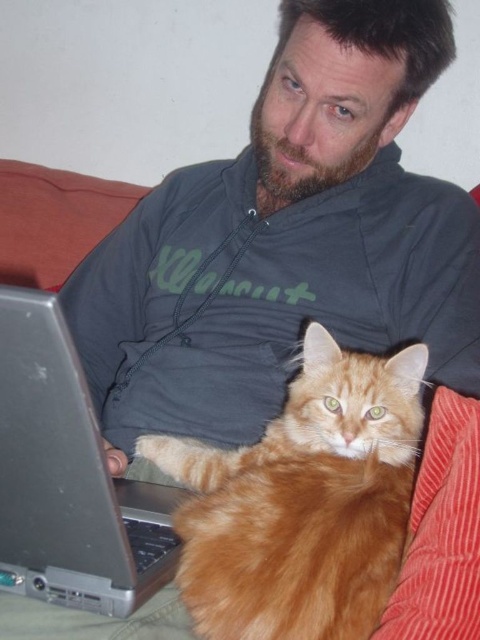
You are a photographer trying to capture the orange fur cat at center and the silver metallic laptop at lower left in the same frame. Based on their positions, can you tell which object is closer to the camera?

The orange fur cat at center is closer to the camera because it is located below the silver metallic laptop at lower left, indicating it is in the foreground.

You are a photographer trying to capture the man and the cat in the image. You want to ensure that both subjects are in focus. Given the two focal points at point (x=184, y=186) and point (x=298, y=426), which point should you focus on to ensure the closest subject is sharp?

Point (x=184, y=186) is further to the viewer than point (x=298, y=426), so you should focus on point (x=184, y=186) to ensure the closest subject is sharp.